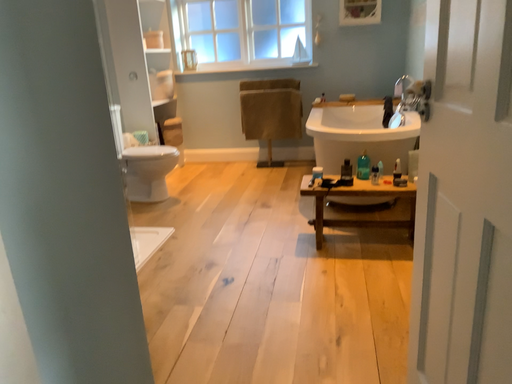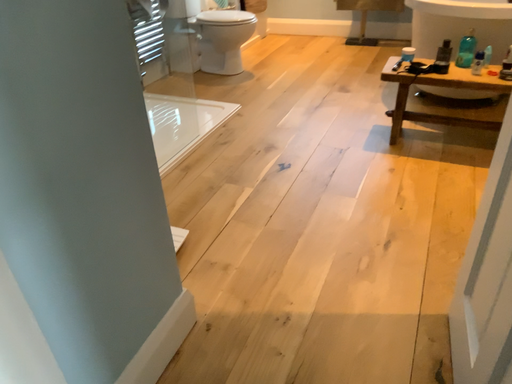
Question: How did the camera likely rotate when shooting the video?

Choices:
 (A) rotated upward
 (B) rotated downward

Answer: (B)